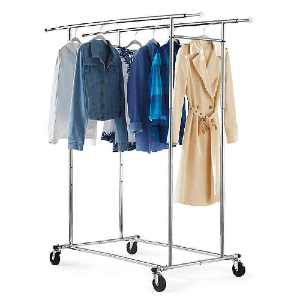
Find the location of `hangers`. hangers is located at coordinates (75, 39), (96, 36), (130, 40), (154, 38), (171, 40), (205, 36).